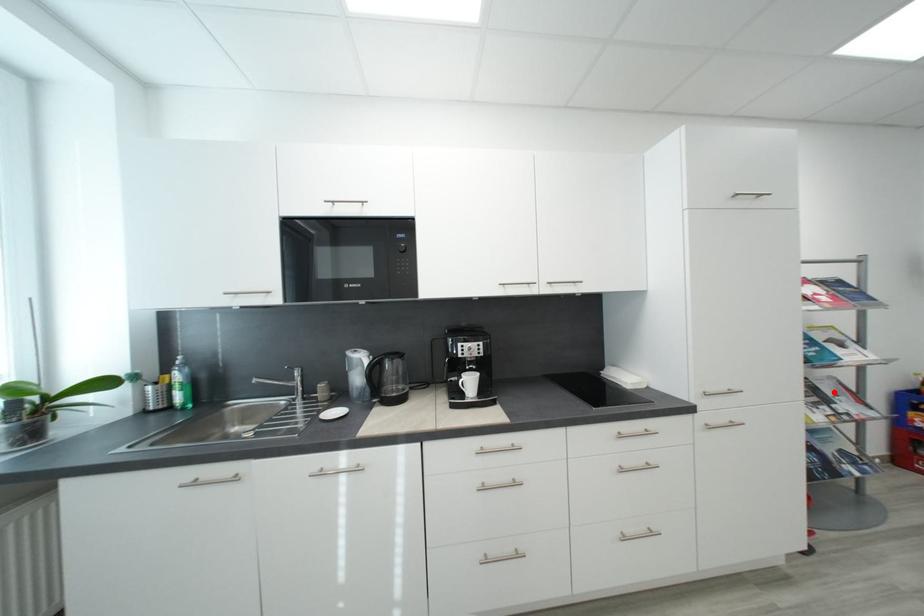
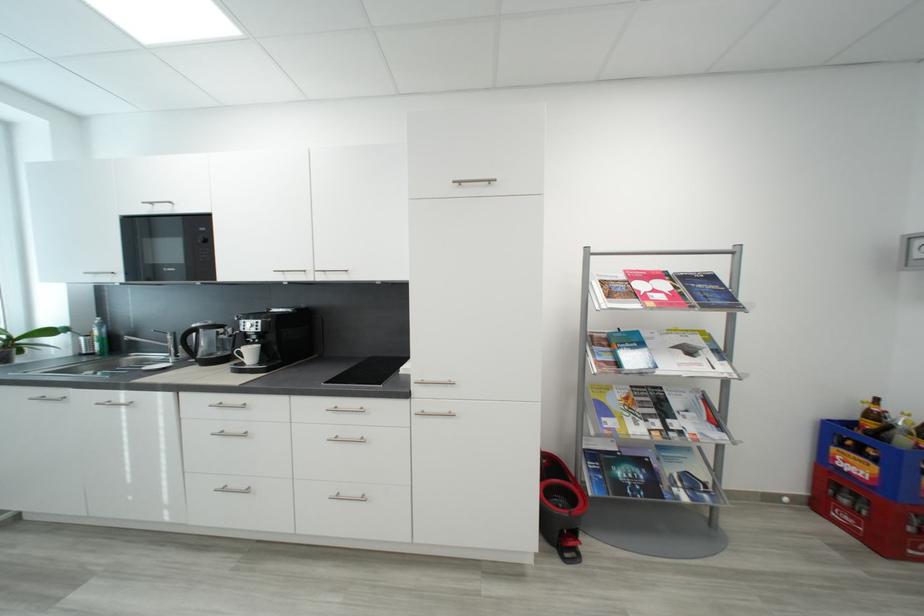
Where in the second image is the point corresponding to the highlighted location from the first image?

(684, 406)